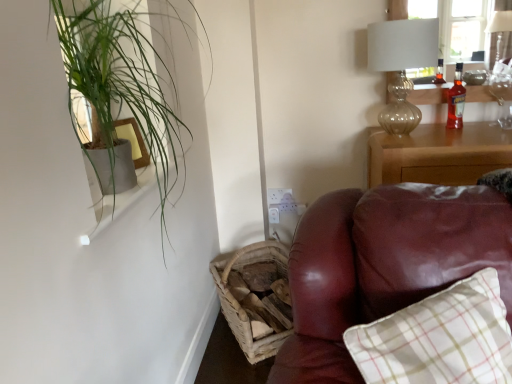
Question: From a real-world perspective, is translucent amber glass bottle at upper right over translucent glass table lamp at upper right?

Choices:
 (A) no
 (B) yes

Answer: (A)

Question: Considering the relative sizes of translucent amber glass bottle at upper right and translucent glass table lamp at upper right in the image provided, is translucent amber glass bottle at upper right bigger than translucent glass table lamp at upper right?

Choices:
 (A) no
 (B) yes

Answer: (A)

Question: Considering the relative sizes of translucent amber glass bottle at upper right and translucent glass table lamp at upper right in the image provided, is translucent amber glass bottle at upper right smaller than translucent glass table lamp at upper right?

Choices:
 (A) yes
 (B) no

Answer: (A)

Question: Is translucent glass table lamp at upper right inside translucent amber glass bottle at upper right?

Choices:
 (A) no
 (B) yes

Answer: (A)

Question: Does translucent amber glass bottle at upper right have a lesser height compared to translucent glass table lamp at upper right?

Choices:
 (A) yes
 (B) no

Answer: (A)

Question: Considering the positions of point (315, 233) and point (95, 228), is point (315, 233) closer or farther from the camera than point (95, 228)?

Choices:
 (A) closer
 (B) farther

Answer: (B)

Question: Is leather couch at right wider or thinner than white glossy window sill at upper left?

Choices:
 (A) wide
 (B) thin

Answer: (A)

Question: Based on their positions, is leather couch at right located to the left or right of white glossy window sill at upper left?

Choices:
 (A) left
 (B) right

Answer: (B)

Question: Considering their positions, is leather couch at right located in front of or behind white glossy window sill at upper left?

Choices:
 (A) behind
 (B) front

Answer: (B)

Question: Relative to translucent amber glass bottle at upper right, is green leafy plant at upper left in front or behind?

Choices:
 (A) front
 (B) behind

Answer: (A)

Question: Looking at their shapes, would you say green leafy plant at upper left is wider or thinner than translucent amber glass bottle at upper right?

Choices:
 (A) wide
 (B) thin

Answer: (A)

Question: From their relative heights in the image, would you say green leafy plant at upper left is taller or shorter than translucent amber glass bottle at upper right?

Choices:
 (A) short
 (B) tall

Answer: (B)

Question: From a real-world perspective, is green leafy plant at upper left positioned above or below translucent amber glass bottle at upper right?

Choices:
 (A) below
 (B) above

Answer: (B)

Question: In terms of size, does matte wood picture frame at upper left appear bigger or smaller than woven wood basket at lower left?

Choices:
 (A) big
 (B) small

Answer: (B)

Question: From a real-world perspective, is matte wood picture frame at upper left physically located above or below woven wood basket at lower left?

Choices:
 (A) above
 (B) below

Answer: (A)